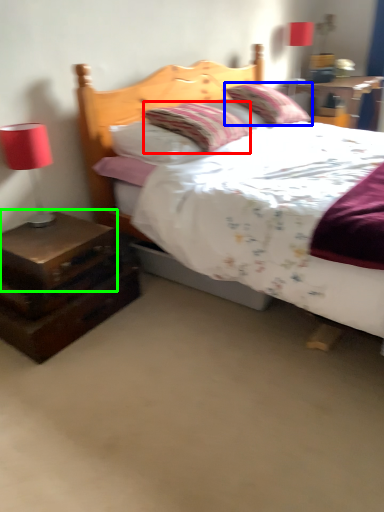
Question: Which object is the closest to the pillow (highlighted by a red box)? Choose among these: pillow (highlighted by a blue box) or nightstand (highlighted by a green box).

Choices:
 (A) pillow
 (B) nightstand

Answer: (A)